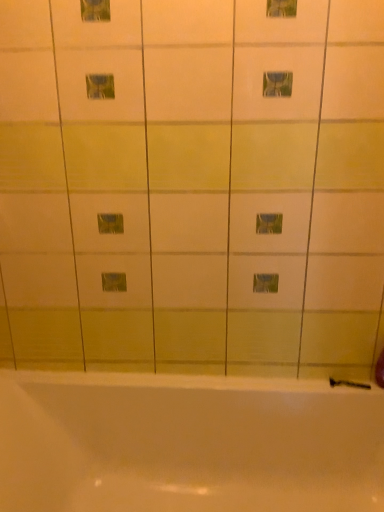
The width and height of the screenshot is (384, 512). Describe the element at coordinates (187, 443) in the screenshot. I see `white glossy bathtub at lower center` at that location.

I want to click on white glossy bathtub at lower center, so coord(187,443).

What do you see at coordinates (348, 384) in the screenshot? I see `black rubber shower at lower right` at bounding box center [348, 384].

This screenshot has height=512, width=384. In order to click on black rubber shower at lower right in this screenshot , I will do `click(348, 384)`.

What is the approximate height of black rubber shower at lower right?

The height of black rubber shower at lower right is 0.82 inches.

What are the coordinates of `white glossy bathtub at lower center` in the screenshot? It's located at (187, 443).

Which object is positioned more to the right, white glossy bathtub at lower center or black rubber shower at lower right?

Positioned to the right is black rubber shower at lower right.

Between white glossy bathtub at lower center and black rubber shower at lower right, which one is positioned in front?

Positioned in front is white glossy bathtub at lower center.

Between point (75, 472) and point (358, 382), which one is positioned behind?

Positioned behind is point (358, 382).

From the image's perspective, is white glossy bathtub at lower center located above black rubber shower at lower right?

No, from the image's perspective, white glossy bathtub at lower center is not over black rubber shower at lower right.

From a real-world perspective, between white glossy bathtub at lower center and black rubber shower at lower right, who is vertically higher?

From a 3D spatial view, black rubber shower at lower right is above.

Can you confirm if white glossy bathtub at lower center is wider than black rubber shower at lower right?

Yes.

Considering the sizes of objects white glossy bathtub at lower center and black rubber shower at lower right in the image provided, who is taller, white glossy bathtub at lower center or black rubber shower at lower right?

With more height is white glossy bathtub at lower center.

Considering the sizes of objects white glossy bathtub at lower center and black rubber shower at lower right in the image provided, who is bigger, white glossy bathtub at lower center or black rubber shower at lower right?

white glossy bathtub at lower center.

Would you say white glossy bathtub at lower center is inside or outside black rubber shower at lower right?

white glossy bathtub at lower center is outside black rubber shower at lower right.

Is white glossy bathtub at lower center beside black rubber shower at lower right?

No.

Is black rubber shower at lower right at the back of white glossy bathtub at lower center?

Absolutely, white glossy bathtub at lower center is directed away from black rubber shower at lower right.

How many degrees apart are the facing directions of white glossy bathtub at lower center and black rubber shower at lower right?

There is a 0.032-degree angle between the facing directions of white glossy bathtub at lower center and black rubber shower at lower right.

You are a GUI agent. You are given a task and a screenshot of the screen. Output one action in this format:
    pyautogui.click(x=<x>, y=<y>)
    Task: Click on the shower behind the white glossy bathtub at lower center
    Image resolution: width=384 pixels, height=512 pixels.
    Given the screenshot: What is the action you would take?
    pyautogui.click(x=348, y=384)

Considering the positions of objects black rubber shower at lower right and white glossy bathtub at lower center in the image provided, who is more to the left, black rubber shower at lower right or white glossy bathtub at lower center?

white glossy bathtub at lower center.

Is black rubber shower at lower right in front of white glossy bathtub at lower center?

No, it is not.

Which is behind, point (348, 382) or point (6, 448)?

The point (348, 382) is farther.

From the image's perspective, which one is positioned higher, black rubber shower at lower right or white glossy bathtub at lower center?

black rubber shower at lower right, from the image's perspective.

From a real-world perspective, is black rubber shower at lower right physically located above or below white glossy bathtub at lower center?

In terms of real-world spatial position, black rubber shower at lower right is above white glossy bathtub at lower center.

Which of these two, black rubber shower at lower right or white glossy bathtub at lower center, is wider?

white glossy bathtub at lower center is wider.

Can you confirm if black rubber shower at lower right is taller than white glossy bathtub at lower center?

No, black rubber shower at lower right is not taller than white glossy bathtub at lower center.

Considering the sizes of objects black rubber shower at lower right and white glossy bathtub at lower center in the image provided, who is smaller, black rubber shower at lower right or white glossy bathtub at lower center?

black rubber shower at lower right.

In the scene shown: Is white glossy bathtub at lower center located within black rubber shower at lower right?

That's incorrect, white glossy bathtub at lower center is not inside black rubber shower at lower right.

Is black rubber shower at lower right directly adjacent to white glossy bathtub at lower center?

black rubber shower at lower right and white glossy bathtub at lower center are not in contact.

Could you tell me if black rubber shower at lower right is turned towards white glossy bathtub at lower center?

Yes.

Can you tell me how much black rubber shower at lower right and white glossy bathtub at lower center differ in facing direction?

There is a 0.032-degree angle between the facing directions of black rubber shower at lower right and white glossy bathtub at lower center.

How distant is black rubber shower at lower right from white glossy bathtub at lower center?

The distance of black rubber shower at lower right from white glossy bathtub at lower center is 23.17 inches.

The width and height of the screenshot is (384, 512). In order to click on bathtub in front of the black rubber shower at lower right in this screenshot , I will do click(187, 443).

There is a white glossy bathtub at lower center. Find the location of `shower above it (from a real-world perspective)`. shower above it (from a real-world perspective) is located at coordinates (348, 384).

Where is `shower on the right of the white glossy bathtub at lower center`? shower on the right of the white glossy bathtub at lower center is located at coordinates (348, 384).